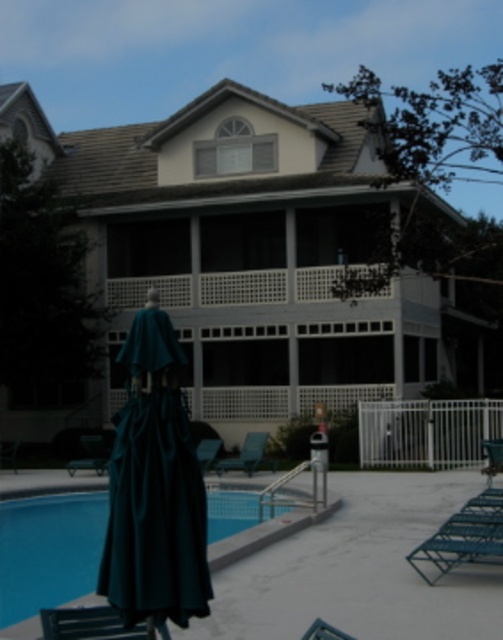
You are planning to place a new potted plant between the teal fabric robe at lower left and the metallic silver beach chair at lower right. Based on their heights, which object should the plant be placed closer to in order to avoid blocking the view from the taller object?

The teal fabric robe at lower left is shorter than the metallic silver beach chair at lower right. To avoid blocking the view from the taller metallic silver beach chair at lower right, the potted plant should be placed closer to the shorter teal fabric robe at lower left.

You are standing at the poolside and want to pick up the teal fabric robe at lower left and the metallic blue lounge chair at lower right. Which object is easier to reach without moving your position?

The teal fabric robe at lower left is closer to the viewer than the metallic blue lounge chair at lower right, so it is easier to reach without moving your position.

You are a guest at this house and need to place the teal fabric robe at lower left somewhere near the pool. The host mentioned that the space must accommodate both the robe and the metallic blue lounge chair at lower right without overcrowding. Considering their sizes, which object should be placed closer to the pool edge to optimize space?

The teal fabric robe at lower left is smaller than the metallic blue lounge chair at lower right. To optimize space, the larger metallic blue lounge chair at lower right should be placed closer to the pool edge, allowing the smaller robe to be positioned slightly back, preventing overcrowding.